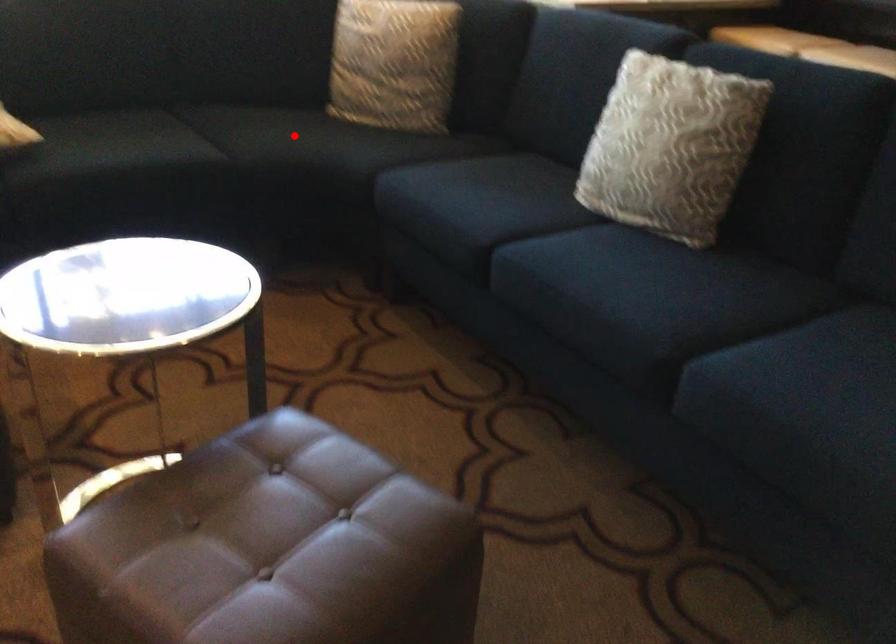
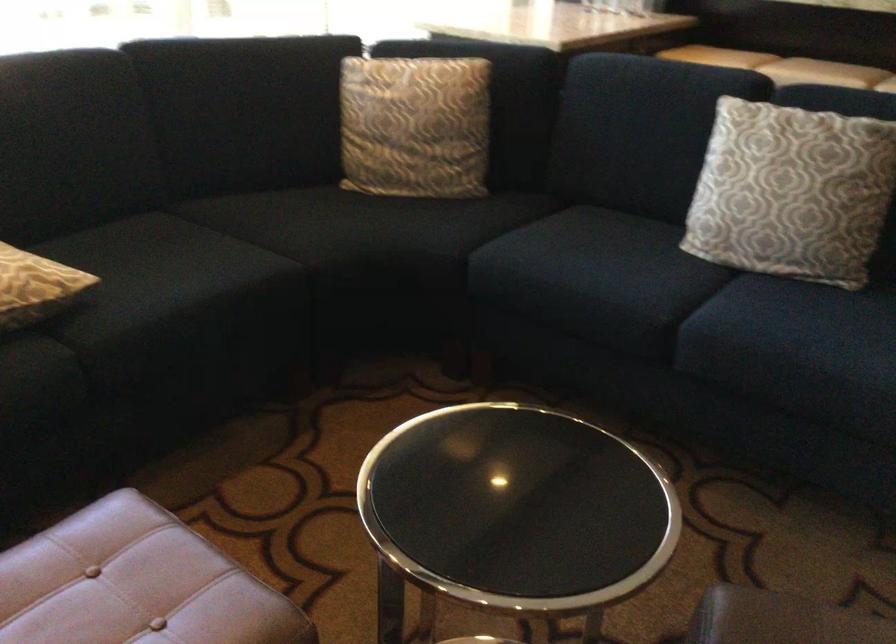
In the second image, find the point that corresponds to the highlighted location in the first image.

(348, 227)